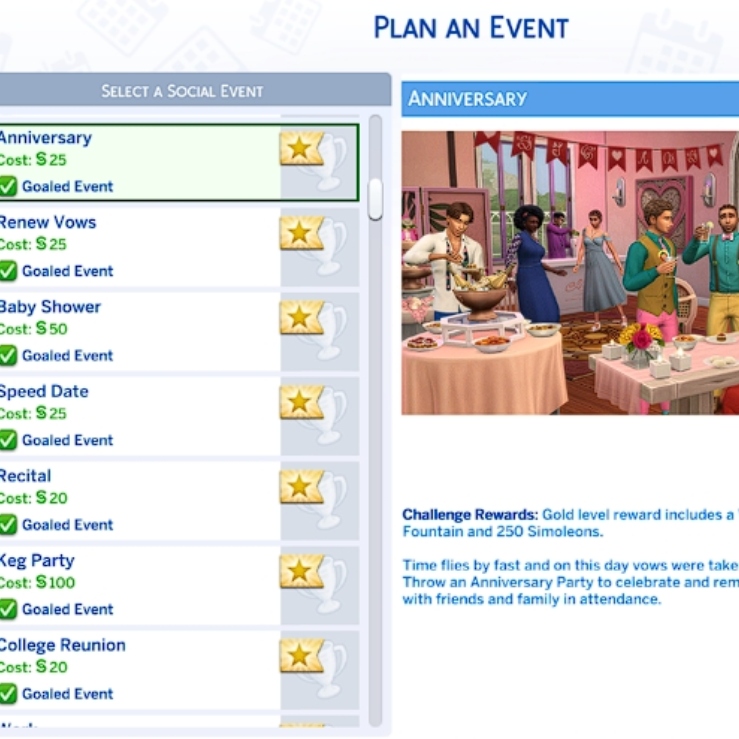
Locate an element on the screen. banquet tables, top right is located at coordinates (491, 380), (630, 378).